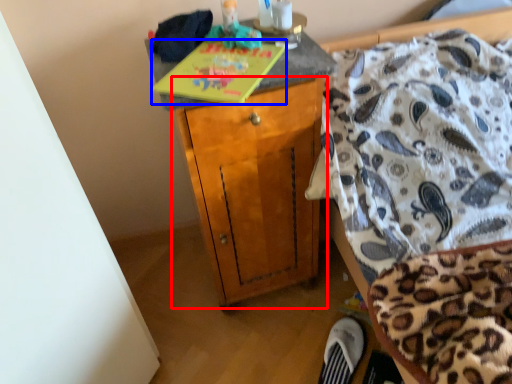
Question: Which object is further to the camera taking this photo, cabinetry (highlighted by a red box) or book (highlighted by a blue box)?

Choices:
 (A) cabinetry
 (B) book

Answer: (A)